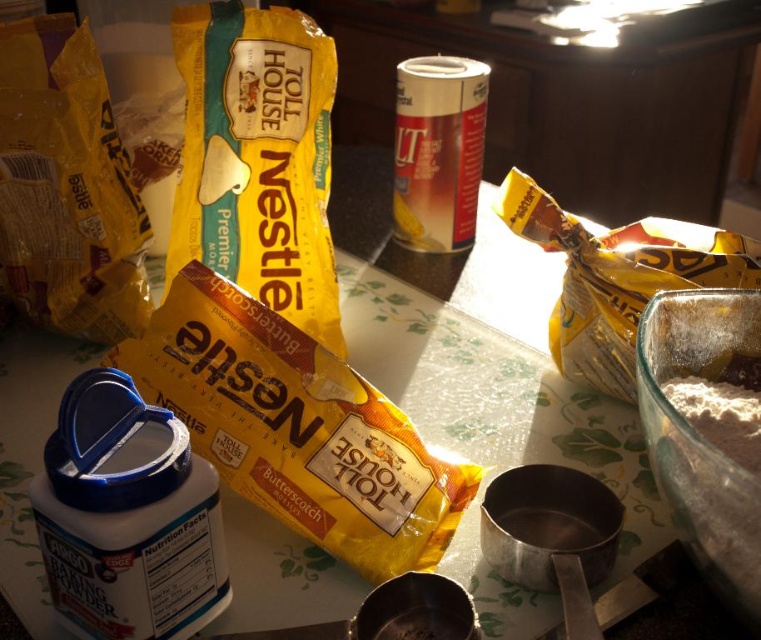
Question: Which object is positioned closest to the matte yellow bag at left?

Choices:
 (A) yellow matte plastic bag of nestle toll house premier butter at center
 (B) yellow matte plastic bag of nestle toll house butterscotch at center

Answer: (A)

Question: From the image, what is the correct spatial relationship of yellow matte plastic bag of nestle toll house premier butter at center in relation to white powdery flour at right?

Choices:
 (A) above
 (B) below

Answer: (A)

Question: Can you confirm if yellow matte plastic bag of nestle toll house butterscotch at center is positioned to the right of yellow matte plastic bag of nestle toll house premier butter at center?

Choices:
 (A) no
 (B) yes

Answer: (B)

Question: Which point is closer to the camera taking this photo?

Choices:
 (A) (64, 305)
 (B) (358, 528)
 (C) (435, 200)

Answer: (B)

Question: Does yellow matte plastic bag of nestle toll house premier butter at center appear over butterscotch candy at upper right?

Choices:
 (A) yes
 (B) no

Answer: (A)

Question: Among these objects, which one is nearest to the camera?

Choices:
 (A) white powdery flour at right
 (B) yellow matte plastic bag of nestle toll house butterscotch at center
 (C) yellow matte plastic bag of nestle toll house premier butter at center

Answer: (A)